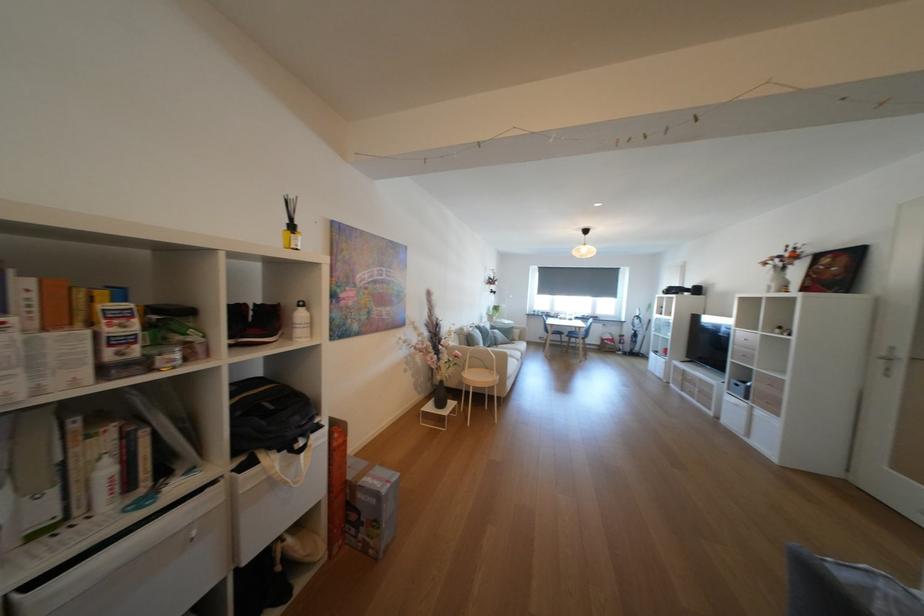
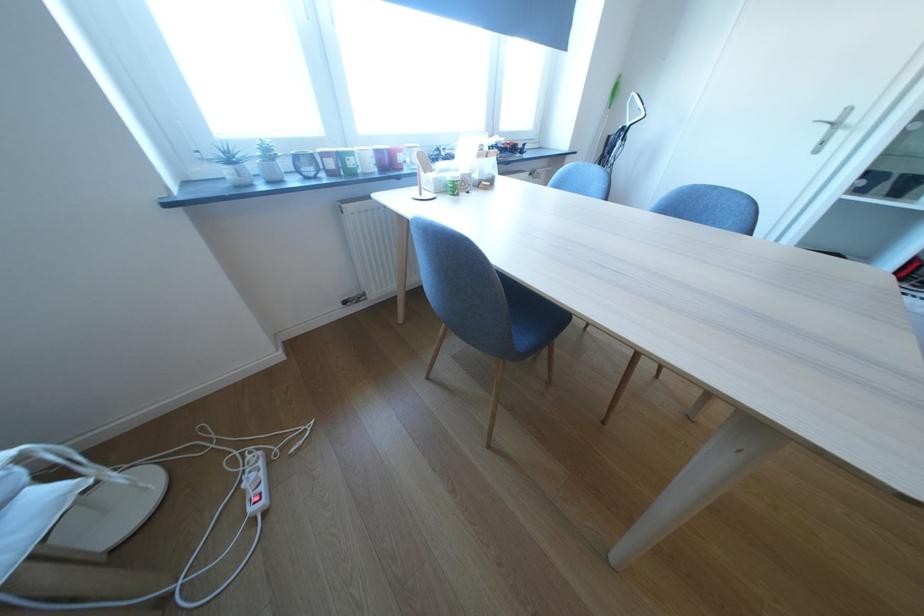
Find the pixel in the second image that matches [556,315] in the first image.

(342, 164)